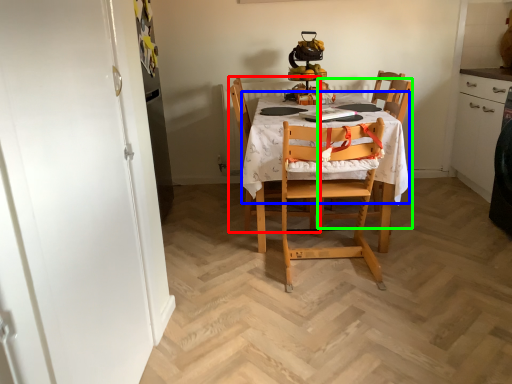
Question: Estimate the real-world distances between objects in this image. Which object is farther from chair (highlighted by a red box), tablecloth (highlighted by a blue box) or chair (highlighted by a green box)?

Choices:
 (A) tablecloth
 (B) chair

Answer: (B)